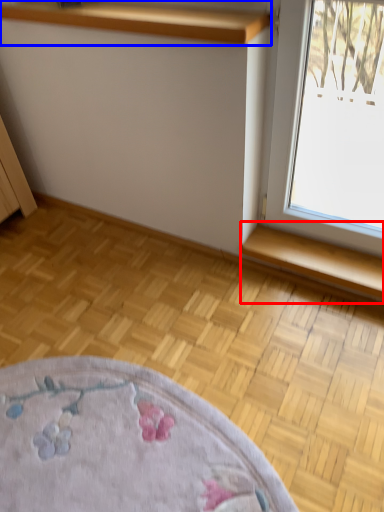
Question: Which object is closer to the camera taking this photo, window sill (highlighted by a red box) or shelf (highlighted by a blue box)?

Choices:
 (A) window sill
 (B) shelf

Answer: (B)